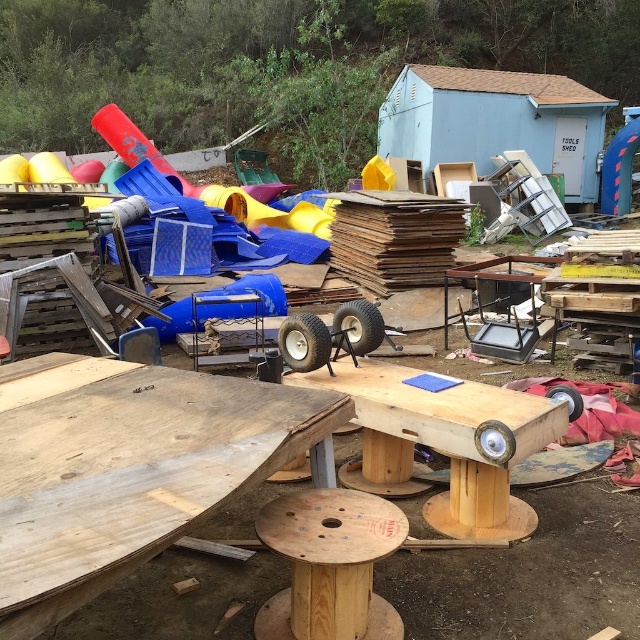
Question: Considering the real-world distances, which object is closest to the blue painted wood shed at upper center?

Choices:
 (A) wooden plank at center
 (B) wooden spool table at center

Answer: (B)

Question: In this image, where is wooden spool table at center located relative to wooden spool at lower center?

Choices:
 (A) above
 (B) below

Answer: (A)

Question: Can you confirm if wooden plank at center is thinner than brown cardboard at center?

Choices:
 (A) no
 (B) yes

Answer: (B)

Question: Which point is closer to the camera?

Choices:
 (A) (448, 243)
 (B) (136, 531)

Answer: (B)

Question: Is blue painted wood shed at upper center bigger than brown cardboard at center?

Choices:
 (A) yes
 (B) no

Answer: (A)

Question: Which object is farther from the camera taking this photo?

Choices:
 (A) brown cardboard at center
 (B) wooden spool at lower center
 (C) wooden plank at center

Answer: (A)